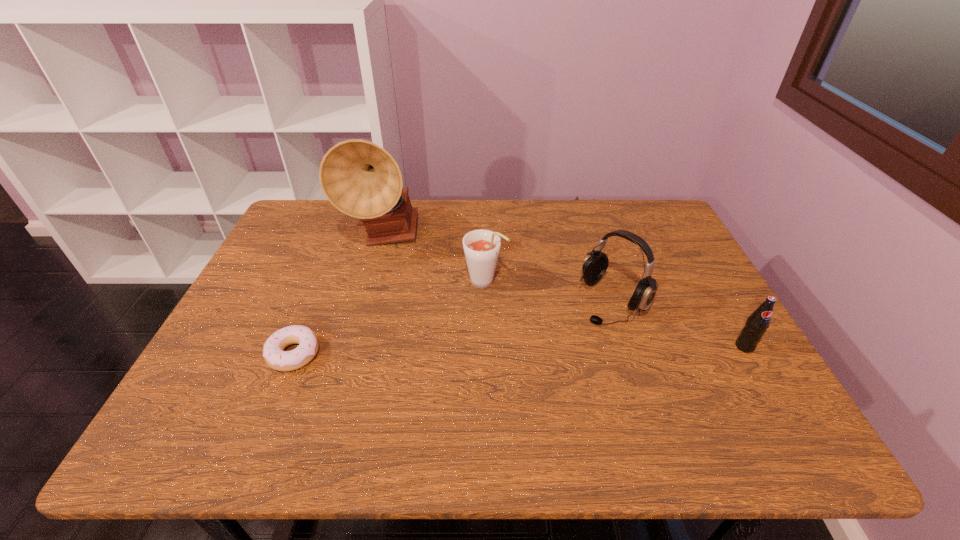
The image size is (960, 540). Identify the location of vacant space located 0.400m on the horn of the tallest object. (464, 352).

What are the coordinates of `vacant space situated 0.300m on the horn of the tallest object` in the screenshot? It's located at (444, 325).

The image size is (960, 540). I want to click on vacant space situated with the microphone on the side of the headset, so click(531, 373).

Where is `free space located 0.320m with the microphone on the side of the headset`? The height and width of the screenshot is (540, 960). free space located 0.320m with the microphone on the side of the headset is located at coordinates (507, 394).

Where is `vacant point located with the microphone on the side of the headset`? The height and width of the screenshot is (540, 960). vacant point located with the microphone on the side of the headset is located at coordinates (572, 338).

I want to click on free space located 0.330m on the drink side of the root beer, so click(596, 367).

In order to click on free spot located on the drink side of the root beer in this screenshot , I will do `click(596, 367)`.

Where is `vacant space situated 0.340m on the drink side of the root beer`? The image size is (960, 540). vacant space situated 0.340m on the drink side of the root beer is located at coordinates tap(599, 370).

Find the location of `object that is positioned at the far edge`. object that is positioned at the far edge is located at coordinates (361, 179).

The height and width of the screenshot is (540, 960). I want to click on object that is at the near edge, so click(x=275, y=357).